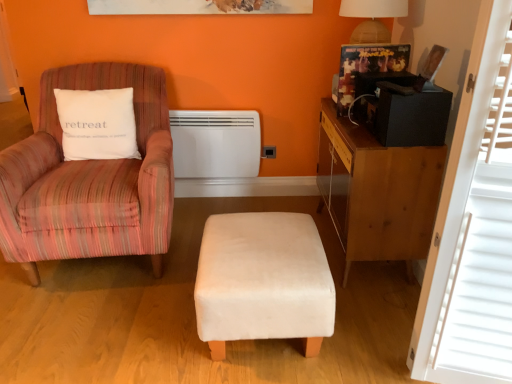
Question: Are white matte heater at center and white velvety pillow at left located far from each other?

Choices:
 (A) no
 (B) yes

Answer: (A)

Question: Is white matte heater at center located outside white velvety pillow at left?

Choices:
 (A) yes
 (B) no

Answer: (A)

Question: Can you confirm if white matte heater at center is smaller than white velvety pillow at left?

Choices:
 (A) yes
 (B) no

Answer: (A)

Question: Could you tell me if white matte heater at center is facing white velvety pillow at left?

Choices:
 (A) no
 (B) yes

Answer: (A)

Question: Can you confirm if white matte heater at center is bigger than white velvety pillow at left?

Choices:
 (A) no
 (B) yes

Answer: (A)

Question: Is white matte heater at center at the right side of white velvety pillow at left?

Choices:
 (A) no
 (B) yes

Answer: (B)

Question: From the image's perspective, would you say pink striped fabric chair at left is shown under white wood window screen at right?

Choices:
 (A) no
 (B) yes

Answer: (A)

Question: Is pink striped fabric chair at left shorter than white wood window screen at right?

Choices:
 (A) yes
 (B) no

Answer: (A)

Question: Is pink striped fabric chair at left looking in the opposite direction of white wood window screen at right?

Choices:
 (A) no
 (B) yes

Answer: (A)

Question: Does pink striped fabric chair at left touch white wood window screen at right?

Choices:
 (A) yes
 (B) no

Answer: (B)

Question: Is pink striped fabric chair at left wider than white wood window screen at right?

Choices:
 (A) yes
 (B) no

Answer: (A)

Question: Does pink striped fabric chair at left turn towards white wood window screen at right?

Choices:
 (A) no
 (B) yes

Answer: (A)

Question: From the image's perspective, is white wood window screen at right over white matte heater at center?

Choices:
 (A) yes
 (B) no

Answer: (B)